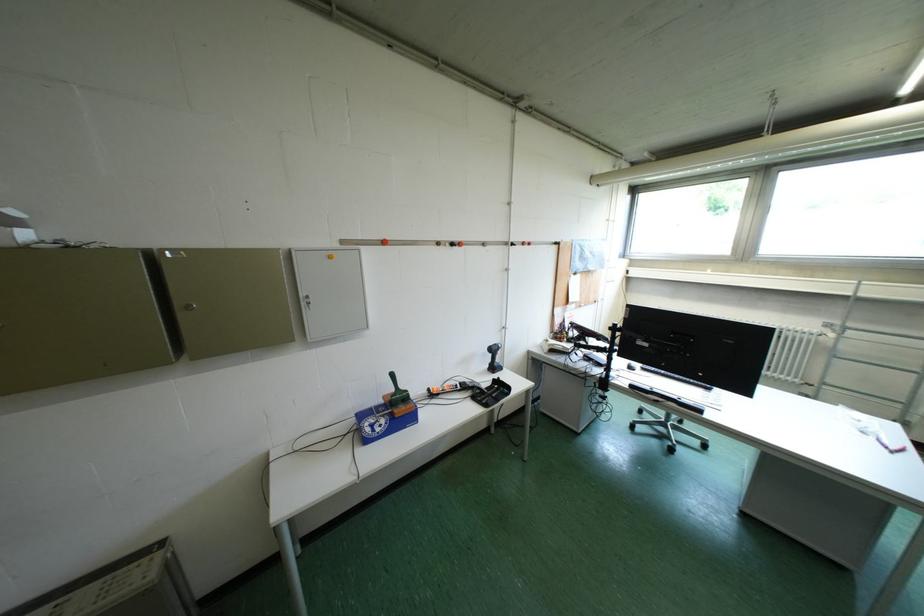
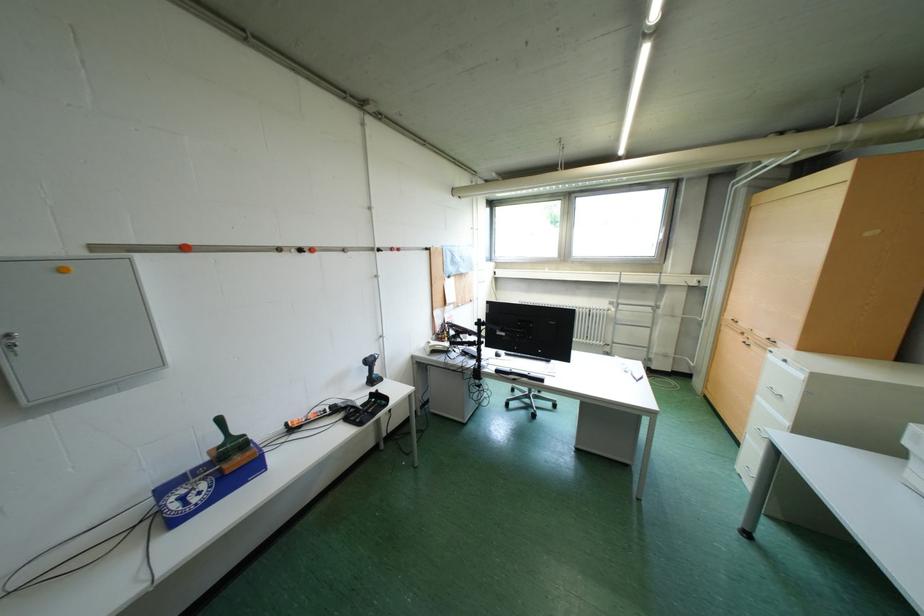
Question: How did the camera likely rotate?

Choices:
 (A) Left
 (B) Right
 (C) Up
 (D) Down

Answer: (B)